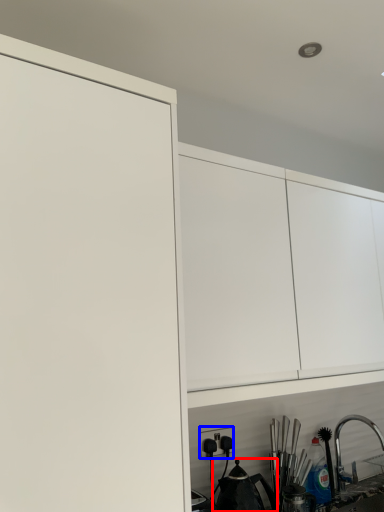
Question: Which point is closer to the camera, tea pot (highlighted by a red box) or electric outlet (highlighted by a blue box)?

Choices:
 (A) tea pot
 (B) electric outlet

Answer: (A)